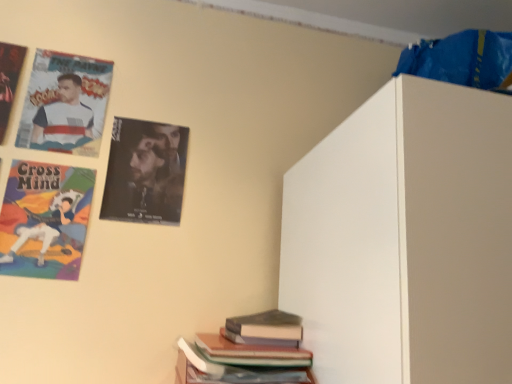
Question: Does cartoon character poster at upper left lie behind hardcover book at lower right, placed as the 2th book when sorted from bottom to top?

Choices:
 (A) yes
 (B) no

Answer: (A)

Question: Is cartoon character poster at upper left shorter than hardcover book at lower right, placed as the 2th book when sorted from bottom to top?

Choices:
 (A) no
 (B) yes

Answer: (A)

Question: Is hardcover book at lower right, placed as the 2th book when sorted from bottom to top, at the back of cartoon character poster at upper left?

Choices:
 (A) no
 (B) yes

Answer: (A)

Question: From the image's perspective, is cartoon character poster at upper left below hardcover book at lower right, the 1th book in the top-to-bottom sequence?

Choices:
 (A) no
 (B) yes

Answer: (A)

Question: From the image's perspective, is cartoon character poster at upper left above hardcover book at lower right, placed as the 2th book when sorted from bottom to top?

Choices:
 (A) no
 (B) yes

Answer: (B)

Question: From a real-world perspective, is cartoon character poster at upper left located beneath hardcover book at lower right, the 1th book in the top-to-bottom sequence?

Choices:
 (A) no
 (B) yes

Answer: (A)

Question: Is matte paper poster at upper left, the second poster when ordered from left to right, at the right side of hardcover book at lower center, the 2th book viewed from the top?

Choices:
 (A) yes
 (B) no

Answer: (B)

Question: Considering the relative sizes of matte paper poster at upper left, the second poster when ordered from left to right, and hardcover book at lower center, the 2th book viewed from the top, in the image provided, is matte paper poster at upper left, the second poster when ordered from left to right, shorter than hardcover book at lower center, the 2th book viewed from the top,?

Choices:
 (A) yes
 (B) no

Answer: (B)

Question: Can you confirm if matte paper poster at upper left, the second poster when ordered from left to right, is smaller than hardcover book at lower center, marked as the first book in a bottom-to-top arrangement?

Choices:
 (A) yes
 (B) no

Answer: (A)

Question: Is matte paper poster at upper left, which is counted as the second poster, starting from the right, positioned in front of hardcover book at lower center, the 2th book viewed from the top?

Choices:
 (A) yes
 (B) no

Answer: (B)

Question: Does matte paper poster at upper left, which is counted as the second poster, starting from the right, have a larger size compared to hardcover book at lower center, marked as the first book in a bottom-to-top arrangement?

Choices:
 (A) no
 (B) yes

Answer: (A)

Question: Is matte paper poster at upper left, the second poster when ordered from left to right, oriented away from hardcover book at lower center, the 2th book viewed from the top?

Choices:
 (A) no
 (B) yes

Answer: (A)

Question: Does cartoon character poster at upper left have a greater width compared to matte paper poster at upper left, the second poster when ordered from left to right?

Choices:
 (A) yes
 (B) no

Answer: (B)